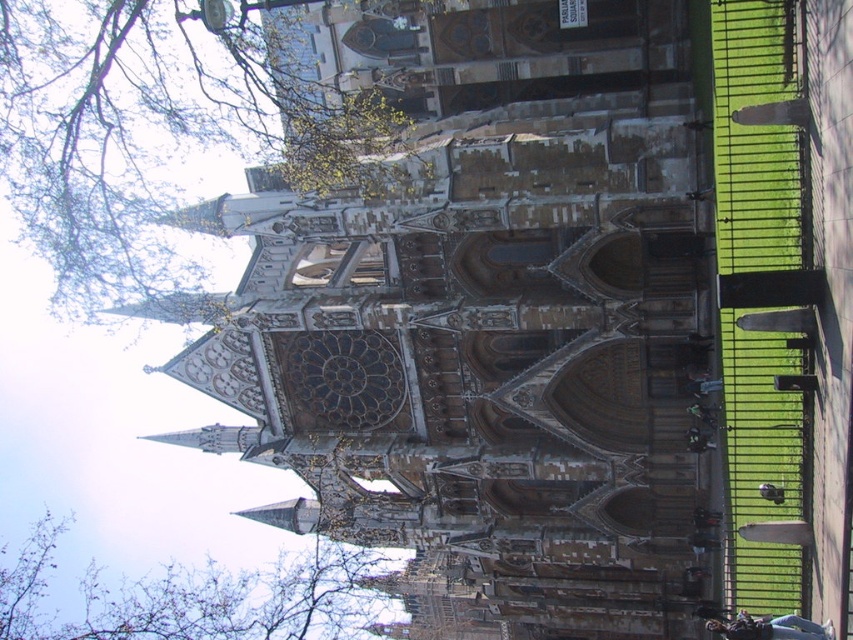
You are an architect examining the cathedral design. You notice the brown stone tower at center and the bare branches at upper left in the image. Which of these two elements occupies a larger area in the scene?

The brown stone tower at center is bigger than bare branches at upper left, so the brown stone tower at center occupies a larger area in the scene.

You are standing in front of the cathedral and notice a point marked at coordinates (486, 316). Which architectural feature does this point correspond to?

The point at coordinates (486, 316) corresponds to the brown stone tower at center.

You are an architect analyzing the cathedral facade. You notice the green leafy tree at upper left and the bare branches at upper left. Which of these two elements is located to the right of the other?

The green leafy tree at upper left is positioned on the right side of the bare branches at upper left.